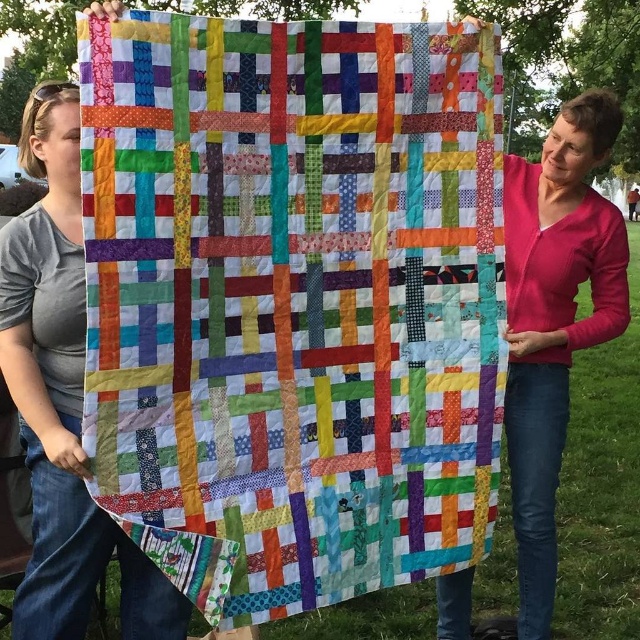
Question: Is quilted fabric quilt at center above matte cotton quilt at left?

Choices:
 (A) yes
 (B) no

Answer: (A)

Question: Which of the following is the farthest from the observer?

Choices:
 (A) (x=310, y=198)
 (B) (x=51, y=557)

Answer: (B)

Question: Which of the following is the farthest from the observer?

Choices:
 (A) (275, 401)
 (B) (70, 476)

Answer: (B)

Question: Considering the relative positions of quilted fabric quilt at center and matte cotton quilt at left in the image provided, where is quilted fabric quilt at center located with respect to matte cotton quilt at left?

Choices:
 (A) above
 (B) below

Answer: (A)

Question: Can you confirm if quilted fabric quilt at center is positioned below matte cotton quilt at left?

Choices:
 (A) no
 (B) yes

Answer: (A)